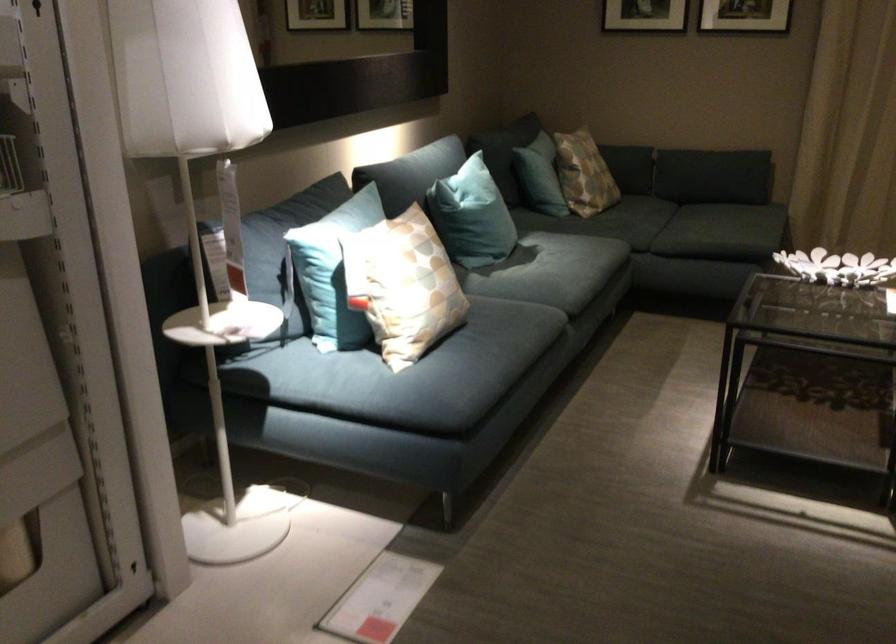
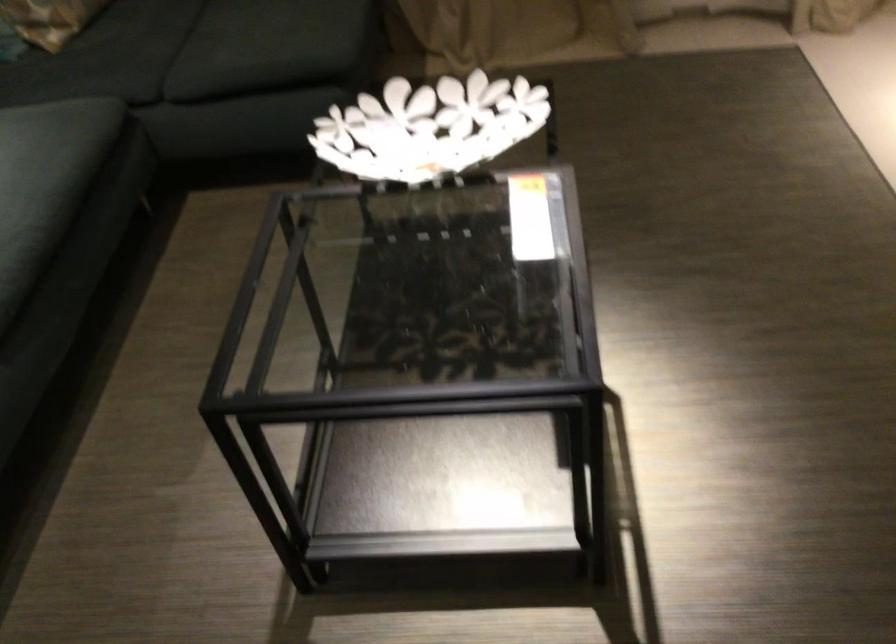
Locate, in the second image, the point that corresponds to (x=616, y=218) in the first image.

(85, 73)